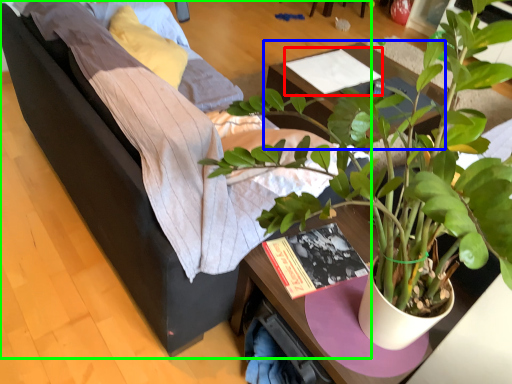
Question: Which is nearer to the magazine (highlighted by a red box)? table (highlighted by a blue box) or studio couch (highlighted by a green box).

Choices:
 (A) table
 (B) studio couch

Answer: (A)